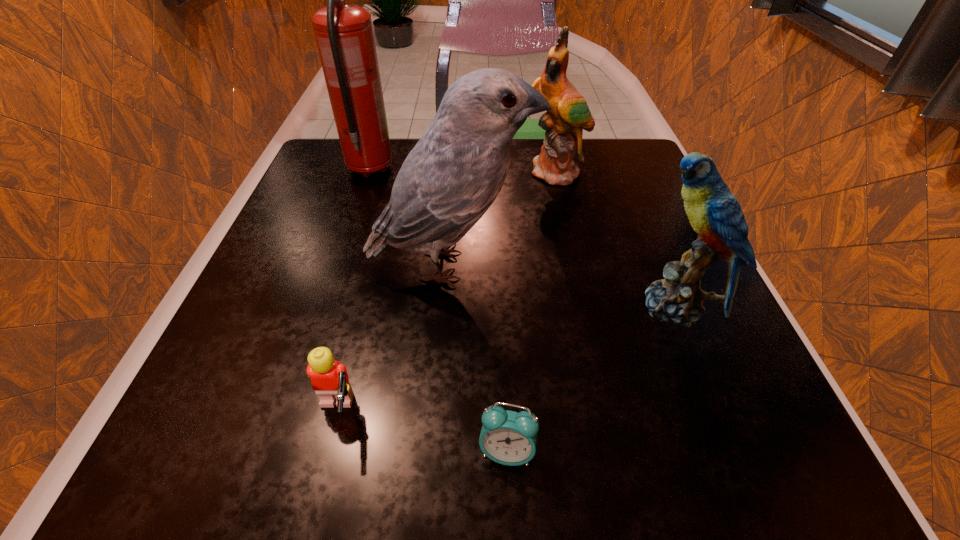
Locate an element on the screen. The image size is (960, 540). object that is at the far left corner is located at coordinates (344, 34).

At what (x,y) coordinates should I click in order to perform the action: click on object at the far right corner. Please return your answer as a coordinate pair (x, y). This screenshot has height=540, width=960. Looking at the image, I should click on (562, 148).

The height and width of the screenshot is (540, 960). I want to click on blank space at the near edge of the desktop, so click(612, 430).

Where is `vacant space at the left edge`? vacant space at the left edge is located at coordinates (297, 290).

In the image, there is a desktop. Where is `vacant space at the right edge`? vacant space at the right edge is located at coordinates (616, 265).

Identify the location of vacant space at the far right corner of the desktop. (599, 153).

The image size is (960, 540). I want to click on vacant space at the near right corner of the desktop, so click(x=684, y=430).

The width and height of the screenshot is (960, 540). I want to click on empty location between the shortest parrot and the leftmost parrot, so click(563, 286).

At what (x,y) coordinates should I click in order to perform the action: click on empty space that is in between the fourth tallest object and the fifth object from left to right. Please return your answer as a coordinate pair (x, y). The height and width of the screenshot is (540, 960). Looking at the image, I should click on (615, 240).

Locate an element on the screen. free space between the Lego and the fifth object from left to right is located at coordinates (446, 293).